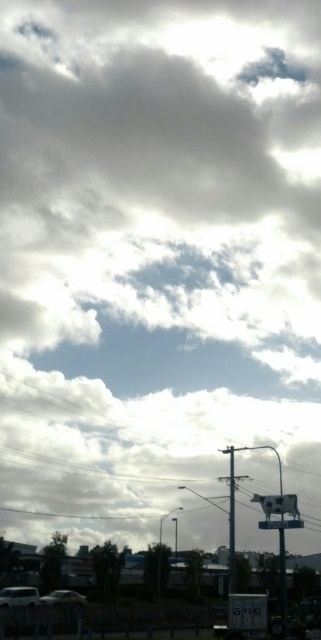
Question: Is metallic pole at center smaller than white matte car at lower left?

Choices:
 (A) no
 (B) yes

Answer: (A)

Question: Which of these objects is positioned closest to the silver metallic car at lower left?

Choices:
 (A) white plastic sign at center
 (B) white matte car at lower left

Answer: (B)

Question: Among these points, which one is nearest to the camera?

Choices:
 (A) (230, 467)
 (B) (43, 604)
 (C) (17, 605)
 (D) (303, 524)

Answer: (D)

Question: Which of these objects is positioned closest to the metallic pole at center?

Choices:
 (A) white plastic sign at center
 (B) white matte car at lower left
 (C) silver metallic car at lower left

Answer: (A)

Question: Does metallic pole at center lie in front of silver metallic car at lower left?

Choices:
 (A) yes
 (B) no

Answer: (A)

Question: Does white matte car at lower left appear on the right side of white plastic sign at center?

Choices:
 (A) yes
 (B) no

Answer: (B)